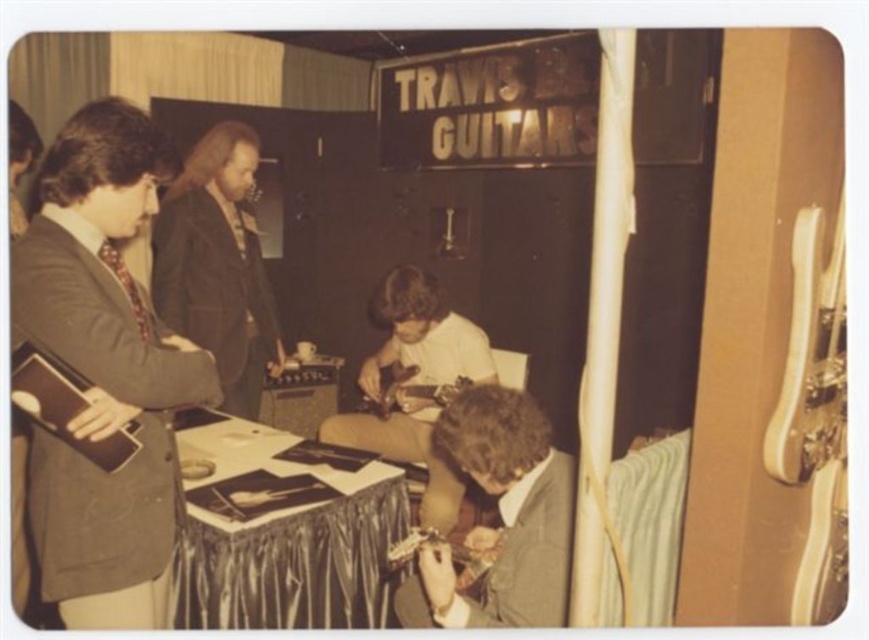
You are standing in front of the table at the guitar exhibition and notice two points marked on the table. Which point is closer to you, point [257,163] or point [453,314]?

Point [257,163] is closer to you because it is further to the viewer than point [453,314].